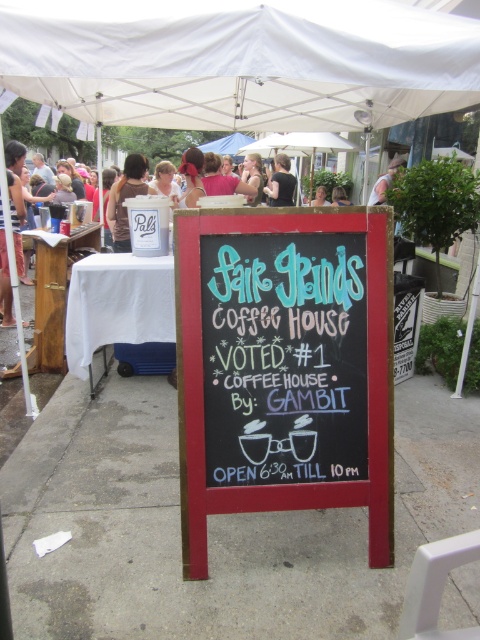
You are a photographer standing at the entrance of the Fair Grinds Coffee House. You want to take a photo of the black shirt at upper center without the white wood table at left blocking the view. Is this possible?

The white wood table at left is in front of the black shirt at upper center, so it would block the view. Move to a different angle or position to avoid the table.

You are at a coffee shop event and want to sit at the white wood table at left. Where should you look to find the black shirt at upper center relative to the table?

The black shirt at upper center is above the white wood table at left.

You are standing at the entrance of the Fair Grinds Coffee House under the white canopy tent. You need to place a small potted plant exactly at the center of the concrete at center. According to the coordinates provided, where should you position the plant?

The concrete at center is located at point (213, 525), so you should position the plant exactly at those coordinates to place it at the center of the concrete at center.